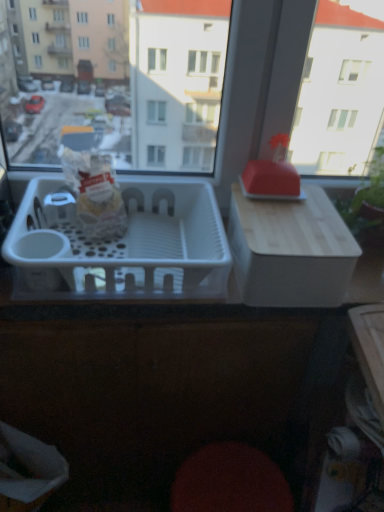
Find the location of a particular element. The height and width of the screenshot is (512, 384). empty space that is ontop of white plastic container at right is located at coordinates (292, 212).